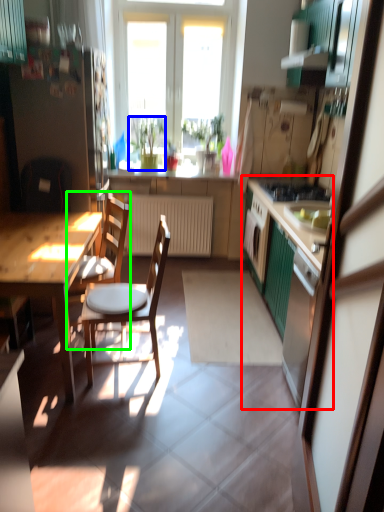
Question: Estimate the real-world distances between objects in this image. Which object is closer to cabinetry (highlighted by a red box), houseplant (highlighted by a blue box) or chair (highlighted by a green box)?

Choices:
 (A) houseplant
 (B) chair

Answer: (B)